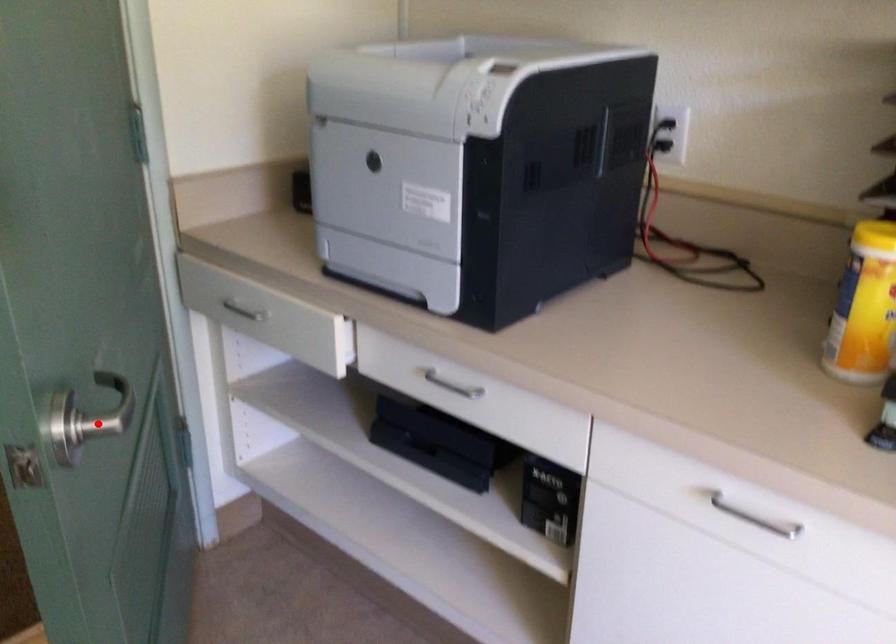
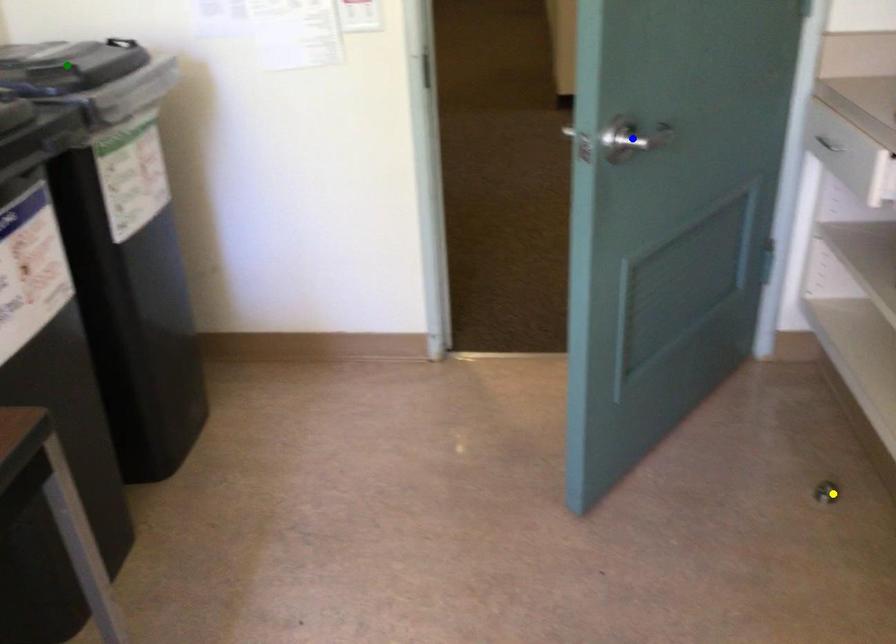
Question: I am providing you with two images of the same scene from different viewpoints. A red point is marked on the first image. You are given multiple points on the second image. Which spot in image 2 lines up with the point in image 1?

Choices:
 (A) green point
 (B) yellow point
 (C) blue point

Answer: (C)